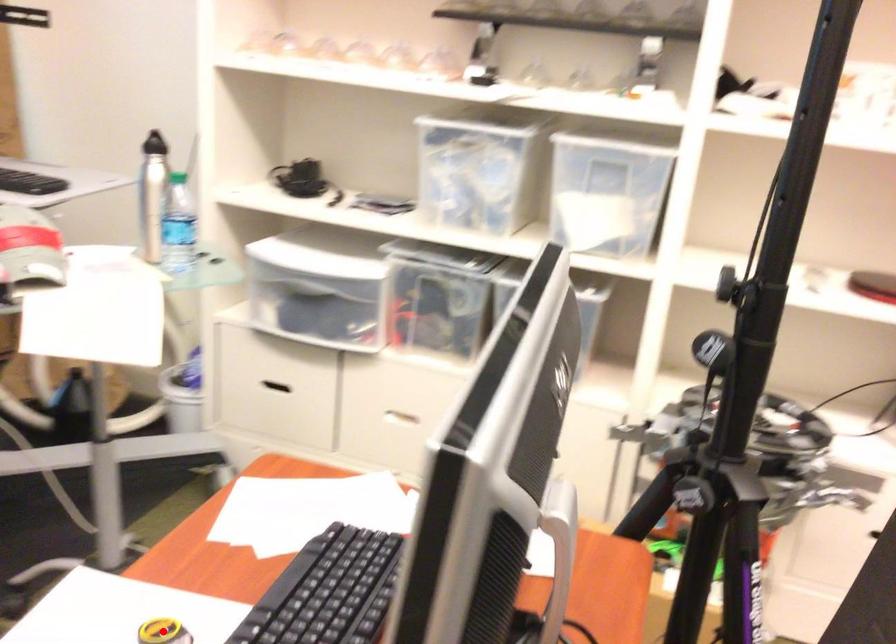
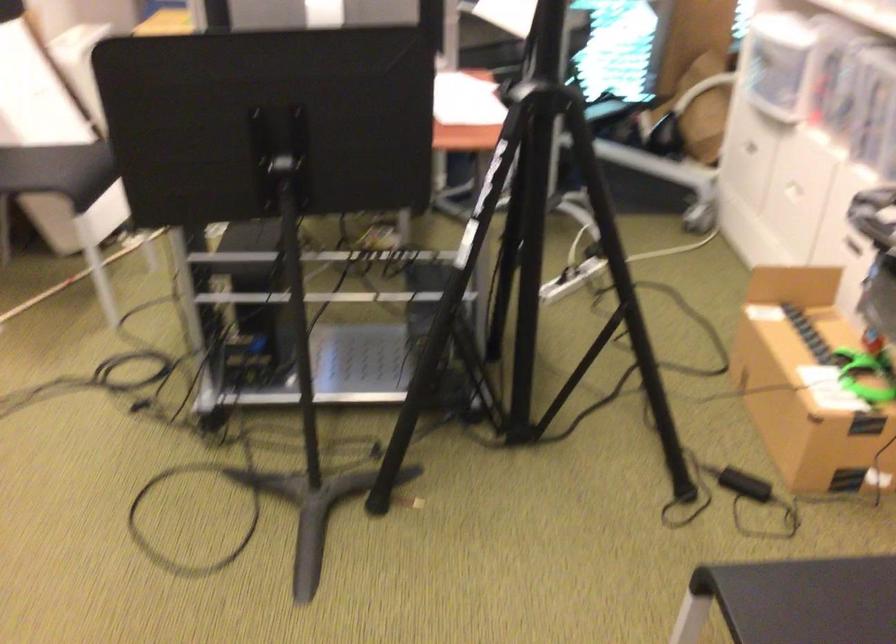
Question: I am providing you with two images of the same scene from different viewpoints. A red point is marked on the first image. At the location where the point appears in image 1, is it still visible in image 2?

Choices:
 (A) Yes
 (B) No

Answer: (B)